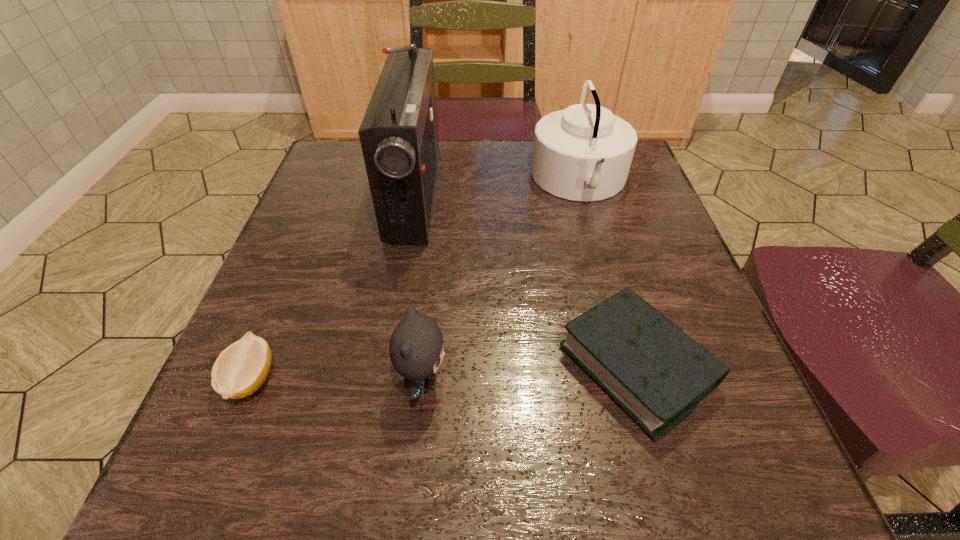
This screenshot has height=540, width=960. I want to click on blank space that satisfies the following two spatial constraints: 1. on the front-facing side of the tallest object; 2. on the right side of the Bible, so click(x=384, y=366).

The height and width of the screenshot is (540, 960). What are the coordinates of `free location that satisfies the following two spatial constraints: 1. on the back side of the Bible; 2. on the left side of the leftmost object` in the screenshot? It's located at (256, 366).